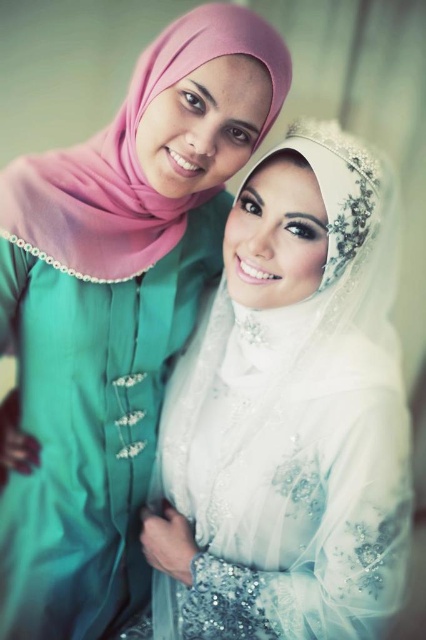
Question: Does satin white veil at center have a smaller size compared to matte pink hijab at upper left?

Choices:
 (A) yes
 (B) no

Answer: (A)

Question: Can you confirm if satin white veil at center is smaller than white sheer veil at upper center?

Choices:
 (A) yes
 (B) no

Answer: (B)

Question: Is matte pink hijab at upper left thinner than white sheer veil at upper center?

Choices:
 (A) yes
 (B) no

Answer: (B)

Question: Estimate the real-world distances between objects in this image. Which object is closer to the satin white veil at center?

Choices:
 (A) matte pink hijab at upper left
 (B) white sheer veil at upper center

Answer: (A)

Question: Which of the following is the closest to the observer?

Choices:
 (A) matte pink hijab at upper left
 (B) satin white veil at center

Answer: (A)

Question: Which point is farther to the camera?

Choices:
 (A) (29, 212)
 (B) (284, 509)

Answer: (B)